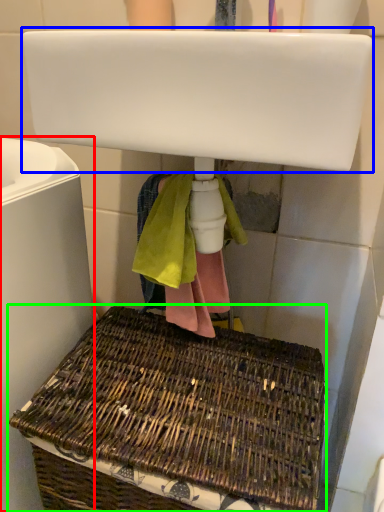
Question: Estimate the real-world distances between objects in this image. Which object is farther from bath (highlighted by a red box), sink (highlighted by a blue box) or picnic basket (highlighted by a green box)?

Choices:
 (A) sink
 (B) picnic basket

Answer: (A)